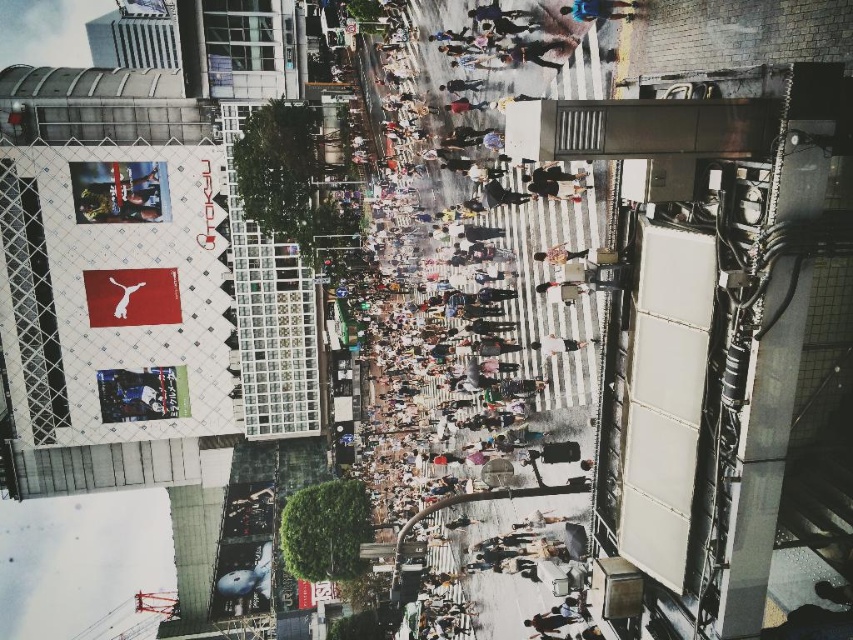
Question: Can you confirm if human crowd at center is thinner than light brown leather bag at center?

Choices:
 (A) no
 (B) yes

Answer: (A)

Question: Which of the following is the closest to the observer?

Choices:
 (A) (584, 204)
 (B) (531, 346)

Answer: (A)

Question: Is light brown leather bag at center in front of light brown leather jacket at center?

Choices:
 (A) no
 (B) yes

Answer: (B)

Question: Does human crowd at center have a smaller size compared to light brown leather bag at center?

Choices:
 (A) yes
 (B) no

Answer: (B)

Question: Which point appears closest to the camera in this image?

Choices:
 (A) [541, 257]
 (B) [543, 352]
 (C) [437, 429]

Answer: (A)

Question: Which object is farther from the camera taking this photo?

Choices:
 (A) light brown leather jacket at center
 (B) human crowd at center

Answer: (A)